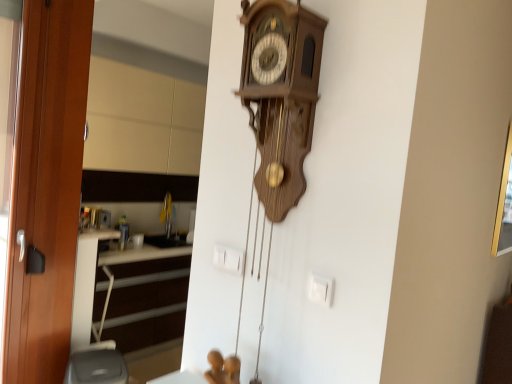
Question: Are wooden door at left and beige matte cabinet at upper left making contact?

Choices:
 (A) no
 (B) yes

Answer: (A)

Question: Is wooden door at left thinner than beige matte cabinet at upper left?

Choices:
 (A) no
 (B) yes

Answer: (B)

Question: Can you confirm if wooden door at left is shorter than beige matte cabinet at upper left?

Choices:
 (A) no
 (B) yes

Answer: (A)

Question: From the image's perspective, is wooden door at left above beige matte cabinet at upper left?

Choices:
 (A) no
 (B) yes

Answer: (A)

Question: Is wooden door at left not within beige matte cabinet at upper left?

Choices:
 (A) no
 (B) yes

Answer: (B)

Question: Considering the positions of gold metallic picture frame at upper right and beige matte cabinet at upper left in the image, is gold metallic picture frame at upper right bigger or smaller than beige matte cabinet at upper left?

Choices:
 (A) big
 (B) small

Answer: (B)

Question: From the image's perspective, relative to beige matte cabinet at upper left, is gold metallic picture frame at upper right above or below?

Choices:
 (A) above
 (B) below

Answer: (B)

Question: Relative to beige matte cabinet at upper left, is gold metallic picture frame at upper right in front or behind?

Choices:
 (A) behind
 (B) front

Answer: (B)

Question: From a real-world perspective, is gold metallic picture frame at upper right physically located above or below beige matte cabinet at upper left?

Choices:
 (A) below
 (B) above

Answer: (A)

Question: Considering their positions, is wooden door at left located in front of or behind beige matte cabinet at upper left?

Choices:
 (A) behind
 (B) front

Answer: (B)

Question: From a real-world perspective, is wooden door at left positioned above or below beige matte cabinet at upper left?

Choices:
 (A) below
 (B) above

Answer: (A)

Question: In terms of width, does wooden door at left look wider or thinner when compared to beige matte cabinet at upper left?

Choices:
 (A) thin
 (B) wide

Answer: (A)

Question: Does point (84, 82) appear closer or farther from the camera than point (152, 26)?

Choices:
 (A) closer
 (B) farther

Answer: (A)

Question: Is beige matte cabinet at upper left inside the boundaries of gold metallic picture frame at upper right, or outside?

Choices:
 (A) outside
 (B) inside

Answer: (A)

Question: Relative to gold metallic picture frame at upper right, is beige matte cabinet at upper left in front or behind?

Choices:
 (A) behind
 (B) front

Answer: (A)